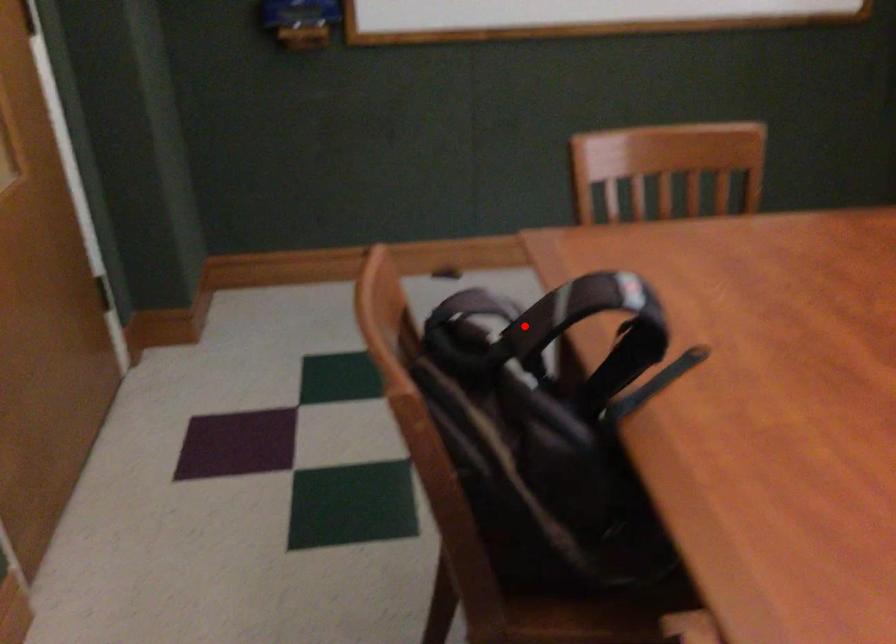
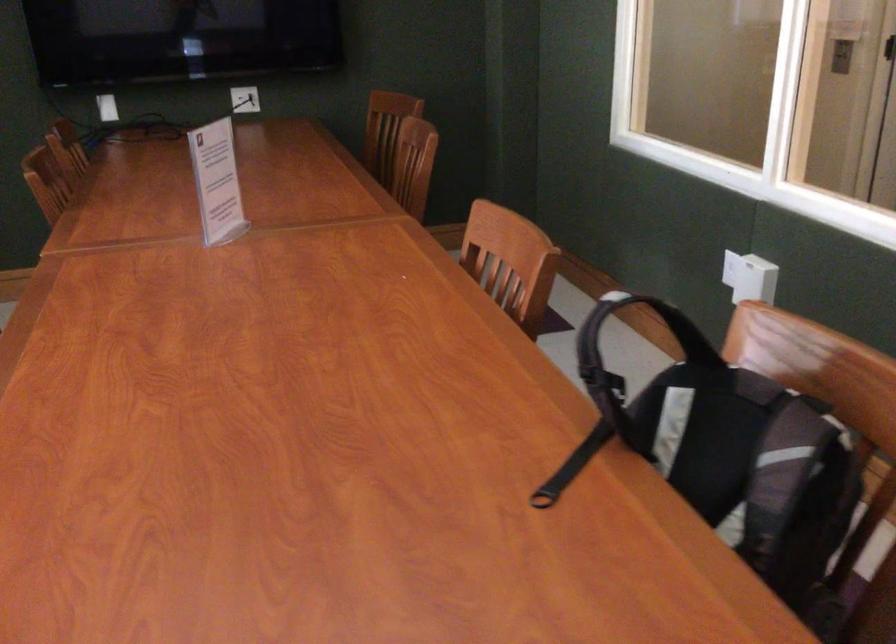
Question: A red point is marked in image1. In image2, is the corresponding 3D point closer to the camera or farther? Reply with the corresponding letter.

Choices:
 (A) The corresponding 3D point is closer.
 (B) The corresponding 3D point is farther.

Answer: (B)